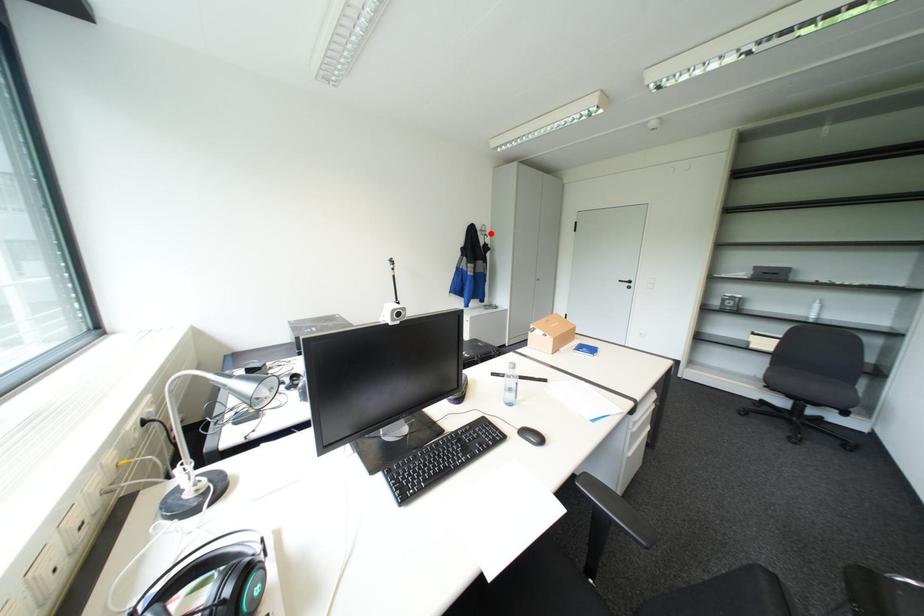
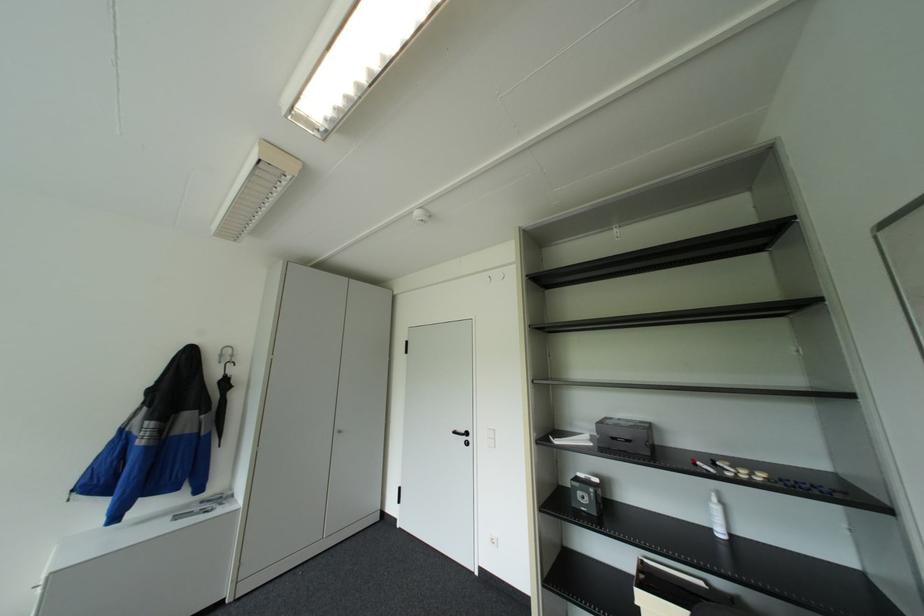
Where in the second image is the point corresponding to the highlighted location from the first image?

(227, 361)